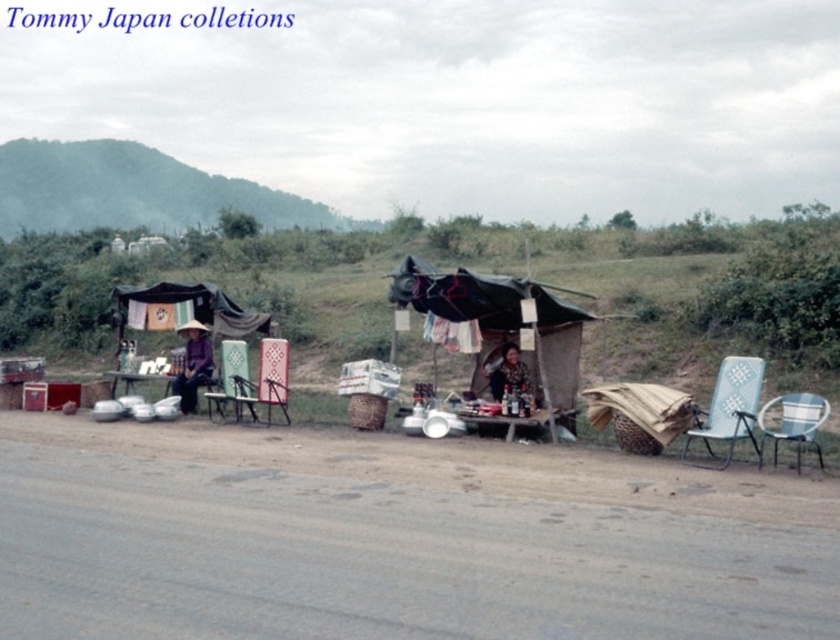
Question: Can you confirm if wooden crates at center is positioned above dark brown woven basket at center?

Choices:
 (A) no
 (B) yes

Answer: (B)

Question: Based on their relative distances, which object is farther from the light blue plastic chair at right?

Choices:
 (A) wooden crates at center
 (B) plastic/metallic chair at right
 (C) purple fabric vendor at left

Answer: (A)

Question: Is light blue plastic chair at right further to camera compared to purple fabric vendor at left?

Choices:
 (A) no
 (B) yes

Answer: (A)

Question: Which object appears closest to the camera in this image?

Choices:
 (A) purple fabric vendor at left
 (B) light blue plastic chair at right
 (C) plastic/metallic chair at right

Answer: (C)

Question: Does dirt track at lower left come behind plastic/metallic chair at right?

Choices:
 (A) yes
 (B) no

Answer: (B)

Question: Based on their relative distances, which object is farther from the dirt track at lower left?

Choices:
 (A) light blue plastic chair at right
 (B) purple fabric vendor at left
 (C) dark brown woven basket at center
 (D) green woven chair at center

Answer: (B)